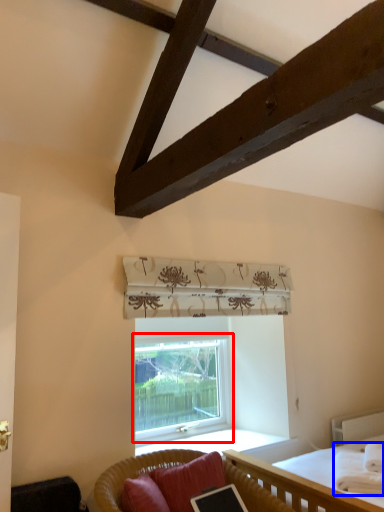
Question: Among these objects, which one is nearest to the camera, window (highlighted by a red box) or blanket (highlighted by a blue box)?

Choices:
 (A) window
 (B) blanket

Answer: (B)